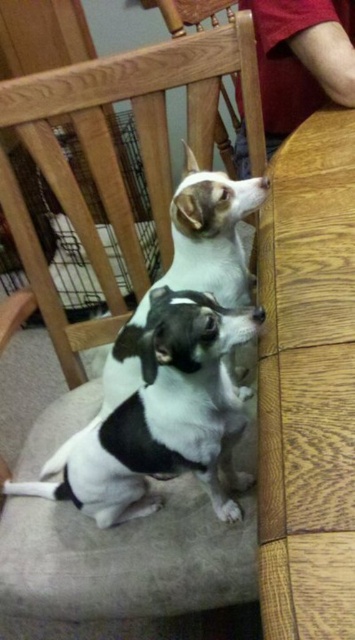
Who is more forward, (293, 236) or (68, 348)?

Point (293, 236) is in front.

Is point (325, 627) closer to camera compared to point (50, 129)?

That is True.

Is point (325, 456) less distant than point (182, 61)?

Yes, point (325, 456) is in front of point (182, 61).

Identify the location of wooden table at right. (308, 385).

Is wooden chair at center taller than black and white fur dog at center?

Correct, wooden chair at center is much taller as black and white fur dog at center.

Can you confirm if wooden chair at center is thinner than black and white fur dog at center?

No, wooden chair at center is not thinner than black and white fur dog at center.

Locate an element on the screen. Image resolution: width=355 pixels, height=640 pixels. wooden chair at center is located at coordinates (116, 156).

You are a GUI agent. You are given a task and a screenshot of the screen. Output one action in this format:
    pyautogui.click(x=<x>, y=<y>)
    Task: Click on the wooden chair at center
    Image resolution: width=355 pixels, height=640 pixels.
    Given the screenshot: What is the action you would take?
    pyautogui.click(x=116, y=156)

Measure the distance from wooden table at right to black and white fur dog at center.

wooden table at right and black and white fur dog at center are 9.18 inches apart.

Is point (280, 348) positioned after point (203, 342)?

Yes, point (280, 348) is farther from viewer.

Locate an element on the screen. The width and height of the screenshot is (355, 640). wooden table at right is located at coordinates [x=308, y=385].